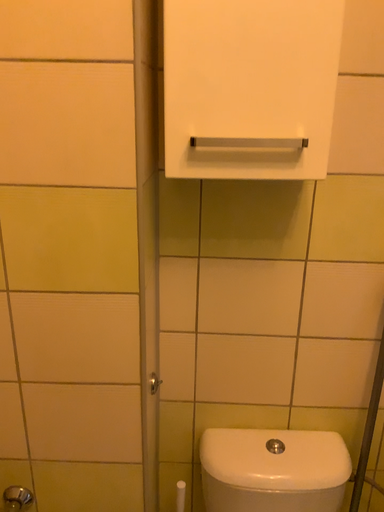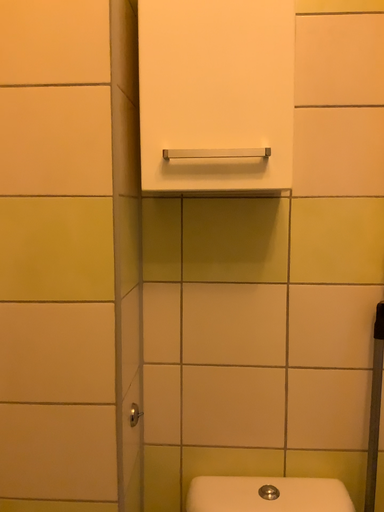
Question: Which way did the camera rotate in the video?

Choices:
 (A) rotated upward
 (B) rotated downward

Answer: (A)